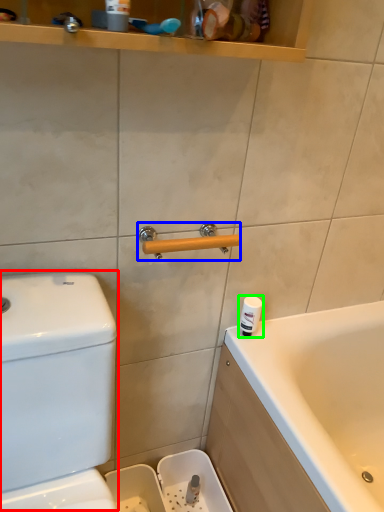
Question: Considering the real-world distances, which object is closest to water tank (highlighted by a red box)? door handle (highlighted by a blue box) or toiletry (highlighted by a green box).

Choices:
 (A) door handle
 (B) toiletry

Answer: (A)